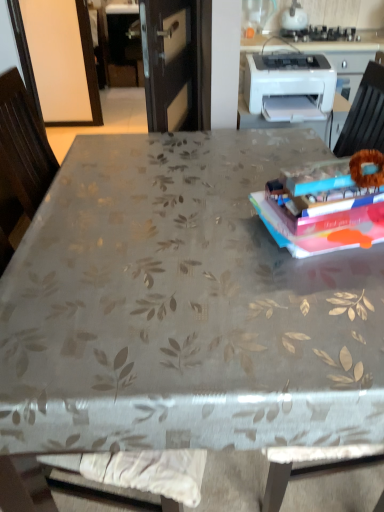
Where is `free space to the back side of hardcover book at upper right`? This screenshot has height=512, width=384. free space to the back side of hardcover book at upper right is located at coordinates (254, 170).